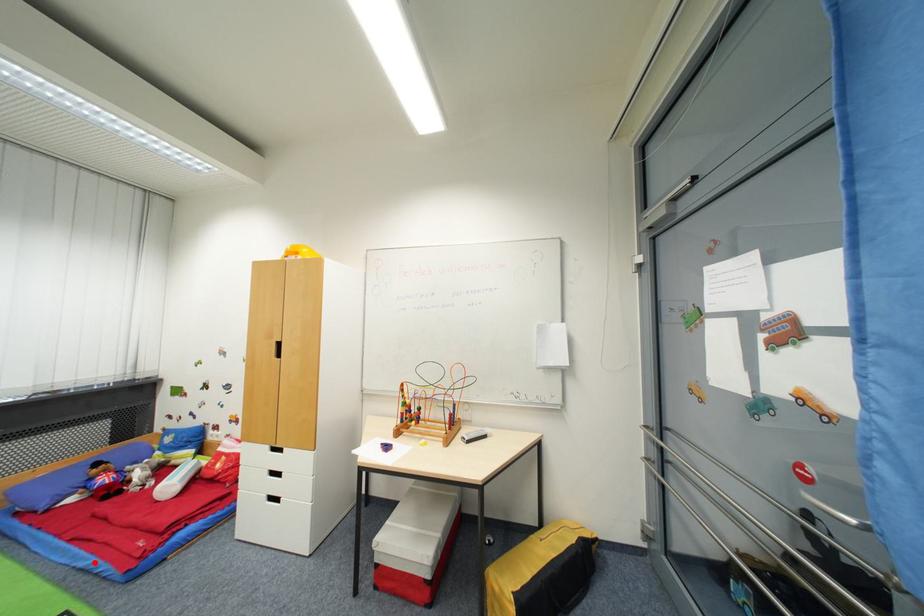
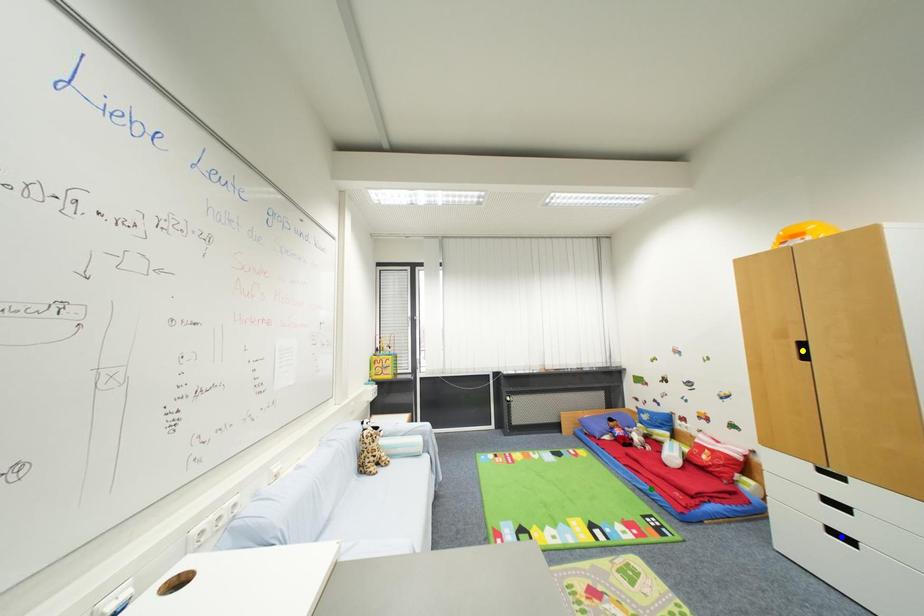
Question: I am providing you with two images of the same scene from different viewpoints. A red point is marked on the first image. You are given multiple points on the second image. Which mark in image 2 goes with the point in image 1?

Choices:
 (A) yellow point
 (B) blue point
 (C) green point

Answer: (C)